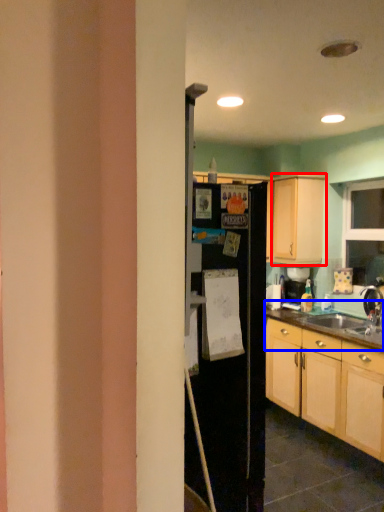
Question: Which object is further to the camera taking this photo, cabinetry (highlighted by a red box) or countertop (highlighted by a blue box)?

Choices:
 (A) cabinetry
 (B) countertop

Answer: (A)